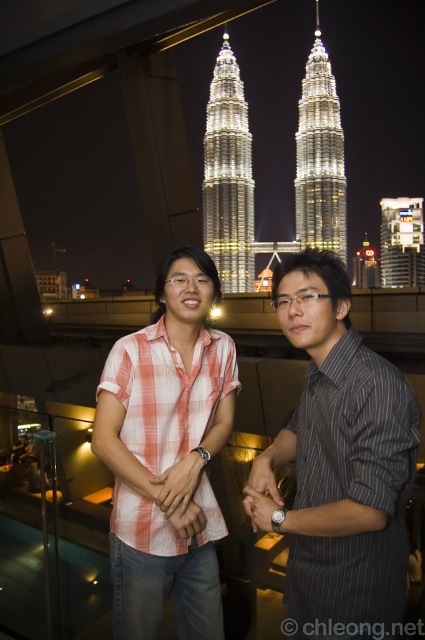
You are a photographer trying to capture a photo of the gray striped shirt at center and the metallic glass building at upper center. Which object is positioned closer to the camera?

The gray striped shirt at center is closer to the camera because it is wider than the metallic glass building at upper center.

You are a photographer trying to capture the entire scene of the shiny gold twin towers at center and the white illuminated building at center in one shot. Based on their widths, which one should you adjust your camera angle to focus on to ensure both are fully visible?

The shiny gold twin towers at center might be wider than the white illuminated building at center, so you should adjust your camera angle to focus on the wider shiny gold twin towers at center to ensure both are fully visible.